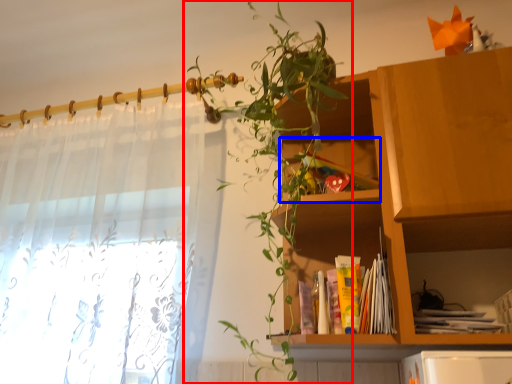
Question: Which of the following is the farthest to the observer, houseplant (highlighted by a red box) or cabinet (highlighted by a blue box)?

Choices:
 (A) houseplant
 (B) cabinet

Answer: (B)